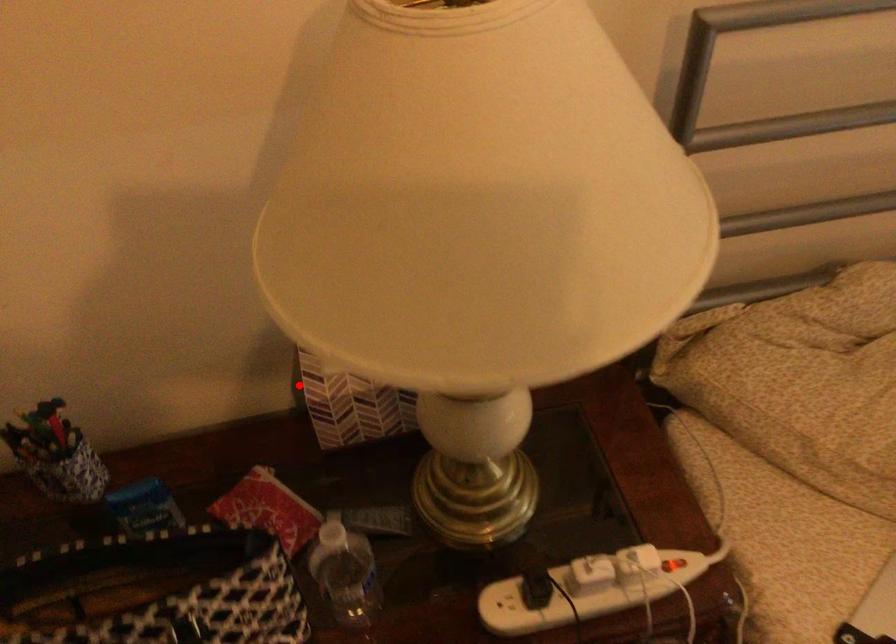
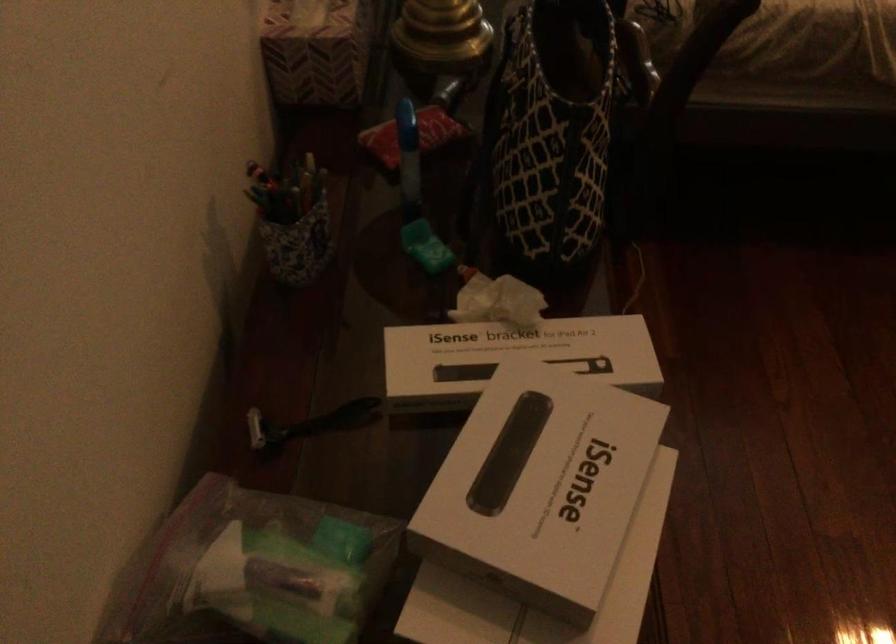
Find the pixel in the second image that matches the highlighted location in the first image.

(315, 51)